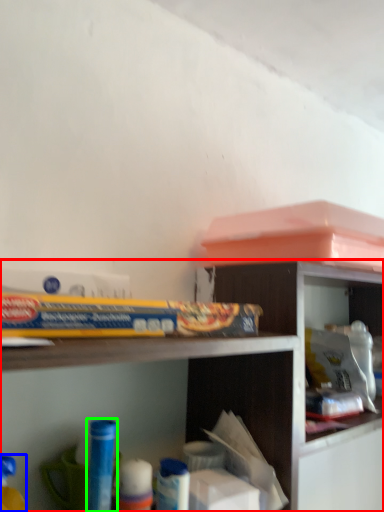
Question: Which object is positioned closest to shelf (highlighted by a red box)? Select from toy (highlighted by a blue box) and toy (highlighted by a green box).

Choices:
 (A) toy
 (B) toy

Answer: (B)